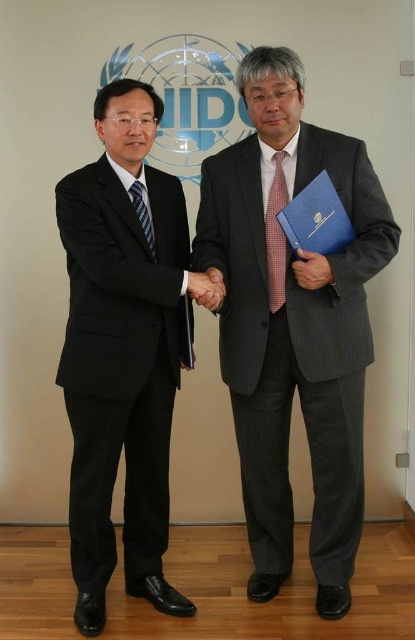
Who is lower down, gray pinstripe suit at center or striped silk tie at left?

gray pinstripe suit at center

Who is more distant from viewer, (283,572) or (146,241)?

The point (283,572) is more distant.

Does point (290, 352) lie behind point (129, 189)?

Yes, it is.

Locate an element on the screen. gray pinstripe suit at center is located at coordinates (x=293, y=326).

Who is higher up, red checkered tie at center or smooth skin handshake at center?

red checkered tie at center is higher up.

Is point (280, 228) positioned before point (215, 298)?

No, it is behind (215, 298).

Where is `red checkered tie at center`? This screenshot has height=640, width=415. red checkered tie at center is located at coordinates tap(275, 236).

Does black matte suit at left appear on the left side of striped silk tie at left?

Yes, black matte suit at left is to the left of striped silk tie at left.

Which is in front, point (146, 486) or point (148, 236)?

Positioned in front is point (148, 236).

I want to click on black matte suit at left, so click(x=121, y=353).